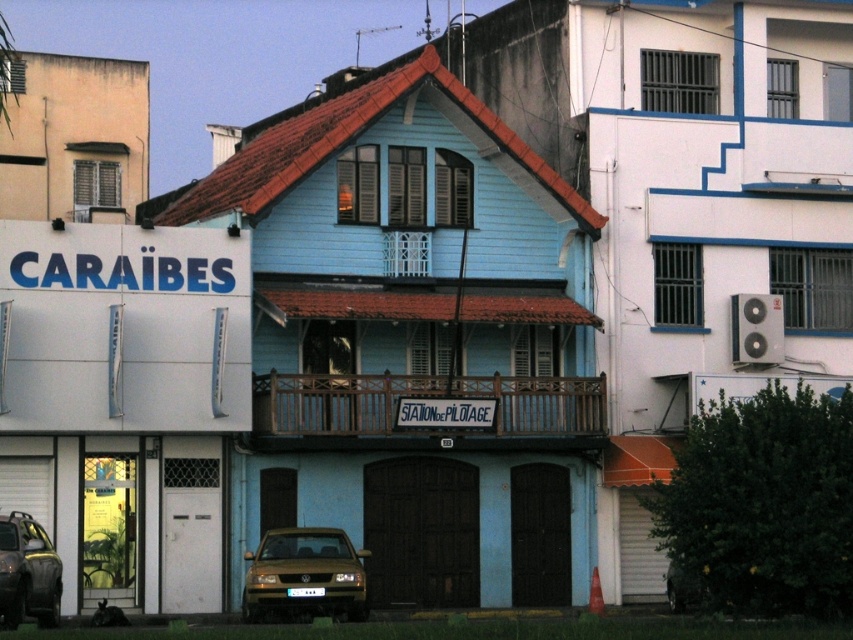
You are a pedestrian standing on the sidewalk and see two metallic gold cars in front of you. One is the gold metallic car at lower center and the other is the metallic gold car at lower left. Which car is closer to you?

The gold metallic car at lower center is closer to you because it is located below the metallic gold car at lower left, meaning it is positioned lower in the visual field and thus nearer.

You are a delivery person needing to park a 2.5 meter wide delivery van between the gold metallic car at lower center and the metallic gold car at lower left. Can the van fit in the space between them?

The gold metallic car at lower center and metallic gold car at lower left are 6.69 meters apart from each other. Since the delivery van is 2.5 meters wide, there is enough space to park it between them as the distance between the cars is greater than the van width.

You are standing in front of the building and want to park your gold metallic car at lower center. The parking spot is located at the point marked by coordinates (305, 576). Is the gold metallic car at lower center currently parked at that location?

Yes, the point (305, 576) marks the gold metallic car at lower center, so it is parked there.